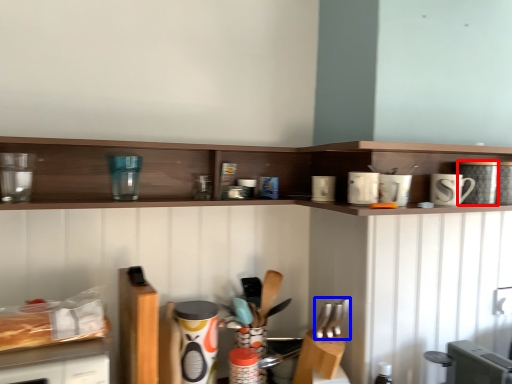
Question: Among these objects, which one is farthest to the camera, appliance (highlighted by a red box) or silverware (highlighted by a blue box)?

Choices:
 (A) appliance
 (B) silverware

Answer: (A)